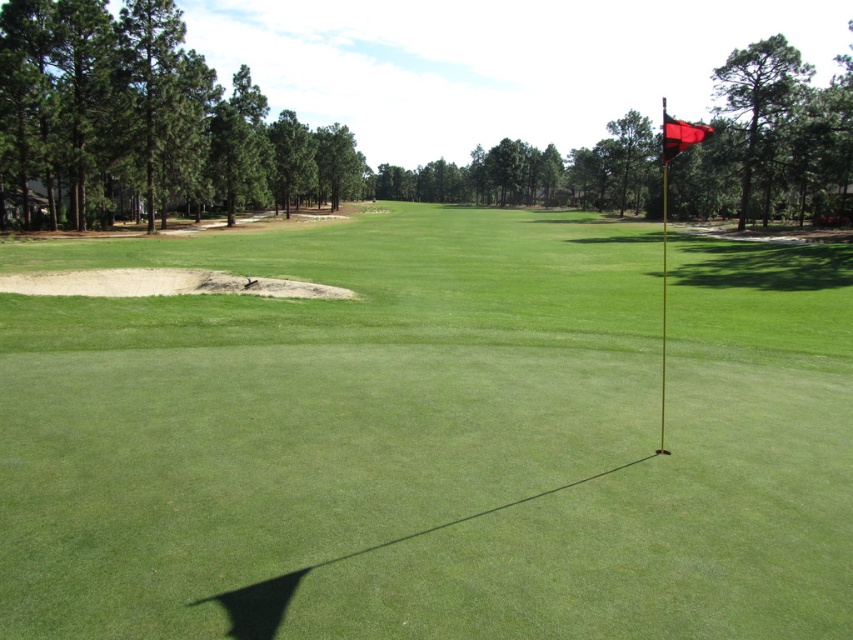
Can you confirm if green turf flag at right is positioned below red fabric flag at upper right?

Indeed, green turf flag at right is positioned under red fabric flag at upper right.

Describe the element at coordinates (305, 404) in the screenshot. I see `green turf flag at right` at that location.

Locate an element on the screen. Image resolution: width=853 pixels, height=640 pixels. green turf flag at right is located at coordinates (305, 404).